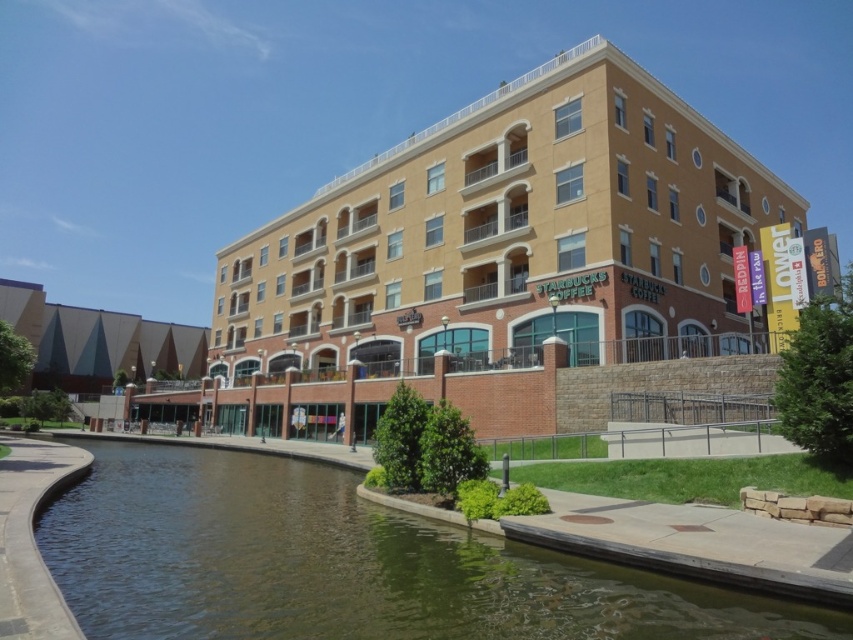
Question: Which object is closer to the camera taking this photo?

Choices:
 (A) brown concrete river at lower left
 (B) beige brick building at center

Answer: (A)

Question: From the image, what is the correct spatial relationship of beige brick building at center in relation to brown concrete river at lower left?

Choices:
 (A) left
 (B) right

Answer: (A)

Question: In this image, where is beige brick building at center located relative to brown concrete river at lower left?

Choices:
 (A) above
 (B) below

Answer: (A)

Question: Can you confirm if beige brick building at center is wider than brown concrete river at lower left?

Choices:
 (A) yes
 (B) no

Answer: (A)